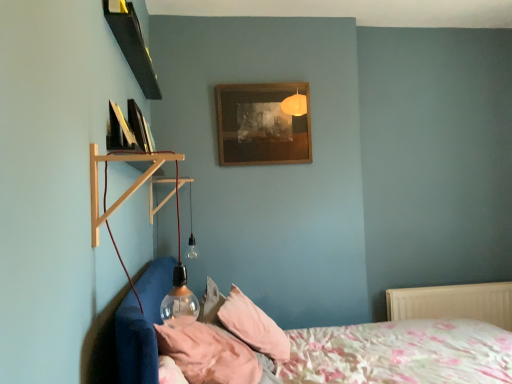
Where is `wooden frame at upper center, marked as the 1th picture frame in a back-to-front arrangement`? The height and width of the screenshot is (384, 512). wooden frame at upper center, marked as the 1th picture frame in a back-to-front arrangement is located at coordinates (261, 125).

What do you see at coordinates (253, 326) in the screenshot? I see `pink fabric pillow at lower center, which is the second pillow in front-to-back order` at bounding box center [253, 326].

Locate an element on the screen. floral cotton bed at lower left is located at coordinates (401, 353).

Where is `wooden frame at upper center, marked as the 1th picture frame in a back-to-front arrangement`? Image resolution: width=512 pixels, height=384 pixels. wooden frame at upper center, marked as the 1th picture frame in a back-to-front arrangement is located at coordinates (261, 125).

Can you tell me how much pink fabric pillow at lower center, which is the second pillow in front-to-back order, and wooden frame at upper center, the second picture frame when ordered from left to right, differ in facing direction?

84.9 degrees separate the facing orientations of pink fabric pillow at lower center, which is the second pillow in front-to-back order, and wooden frame at upper center, the second picture frame when ordered from left to right.

From the picture: From a real-world perspective, which object stands above the other?

wooden frame at upper center, marked as the 1th picture frame in a back-to-front arrangement, from a real-world perspective.

Which is closer to the camera, [228,317] or [253,111]?

Point [228,317].

From a real-world perspective, is pink fabric pillow at lower center, the 1th pillow positioned from the back, below floral cotton bed at lower left?

No, from a real-world perspective, pink fabric pillow at lower center, the 1th pillow positioned from the back, is not under floral cotton bed at lower left.

Which is more to the left, pink fabric pillow at lower center, the 1th pillow positioned from the back, or floral cotton bed at lower left?

Positioned to the left is pink fabric pillow at lower center, the 1th pillow positioned from the back.

Considering the points (278, 341) and (471, 352), which point is behind, point (278, 341) or point (471, 352)?

The point (278, 341) is farther.

Is pink fabric pillow at lower center, which appears as the 1th pillow when viewed from the front, a part of white plastic radiator at lower right?

No, white plastic radiator at lower right does not contain pink fabric pillow at lower center, which appears as the 1th pillow when viewed from the front.

Which is closer, [466,303] or [251,381]?

Clearly, point [466,303] is more distant from the camera than point [251,381].

What's the angular difference between white plastic radiator at lower right and pink fabric pillow at lower center, which appears as the 1th pillow when viewed from the front,'s facing directions?

white plastic radiator at lower right and pink fabric pillow at lower center, which appears as the 1th pillow when viewed from the front, are facing 75 degrees away from each other.

Based on the photo, from the image's perspective, who appears lower, white plastic radiator at lower right or pink fabric pillow at lower center, which appears as the 1th pillow when viewed from the front?

white plastic radiator at lower right is shown below in the image.

Which of these two, black glossy picture frame at upper left, acting as the first picture frame starting from the left, or floral cotton bed at lower left, stands shorter?

With less height is black glossy picture frame at upper left, acting as the first picture frame starting from the left.

From a real-world perspective, who is located lower, black glossy picture frame at upper left, which appears as the first picture frame when viewed from the front, or floral cotton bed at lower left?

floral cotton bed at lower left is physically lower.

Is black glossy picture frame at upper left, positioned as the 2th picture frame in back-to-front order, aimed at floral cotton bed at lower left?

No, black glossy picture frame at upper left, positioned as the 2th picture frame in back-to-front order, is not aimed at floral cotton bed at lower left.

Consider the image. Is black glossy picture frame at upper left, positioned as the 2th picture frame in back-to-front order, spatially inside floral cotton bed at lower left, or outside of it?

black glossy picture frame at upper left, positioned as the 2th picture frame in back-to-front order, lies outside floral cotton bed at lower left.

Looking at their sizes, would you say black glossy picture frame at upper left, positioned as the 2th picture frame in back-to-front order, is wider or thinner than pink fabric pillow at lower center, which is the second pillow in front-to-back order?

Clearly, black glossy picture frame at upper left, positioned as the 2th picture frame in back-to-front order, has less width compared to pink fabric pillow at lower center, which is the second pillow in front-to-back order.

Can you confirm if black glossy picture frame at upper left, which appears as the first picture frame when viewed from the front, is taller than pink fabric pillow at lower center, the 1th pillow positioned from the back?

Incorrect, the height of black glossy picture frame at upper left, which appears as the first picture frame when viewed from the front, is not larger of that of pink fabric pillow at lower center, the 1th pillow positioned from the back.

From the image's perspective, which is below, black glossy picture frame at upper left, positioned as the 2th picture frame in back-to-front order, or pink fabric pillow at lower center, the 1th pillow positioned from the back?

pink fabric pillow at lower center, the 1th pillow positioned from the back, appears lower in the image.

Considering their positions, is black glossy picture frame at upper left, which appears as the first picture frame when viewed from the front, located in front of or behind pink fabric pillow at lower center, which is the second pillow in front-to-back order?

Clearly, black glossy picture frame at upper left, which appears as the first picture frame when viewed from the front, is in front of pink fabric pillow at lower center, which is the second pillow in front-to-back order.

Which is more to the left, wooden frame at upper center, the second picture frame when ordered from left to right, or pink fabric pillow at lower center, which appears as the 1th pillow when viewed from the front?

pink fabric pillow at lower center, which appears as the 1th pillow when viewed from the front.

Starting from the wooden frame at upper center, marked as the 1th picture frame in a back-to-front arrangement, which pillow is the 2nd one to the left? Please provide its 2D coordinates.

[(208, 354)]

From a real-world perspective, is wooden frame at upper center, the second picture frame when ordered from left to right, positioned above or below pink fabric pillow at lower center, which is the second pillow in back-to-front order?

wooden frame at upper center, the second picture frame when ordered from left to right, is situated higher than pink fabric pillow at lower center, which is the second pillow in back-to-front order, in the real world.

Is wooden frame at upper center, marked as the 1th picture frame in a back-to-front arrangement, further to camera compared to pink fabric pillow at lower center, which is the second pillow in front-to-back order?

Yes, wooden frame at upper center, marked as the 1th picture frame in a back-to-front arrangement, is further from the viewer.

From a real-world perspective, relative to pink fabric pillow at lower center, which is the second pillow in front-to-back order, is wooden frame at upper center, the second picture frame when ordered from left to right, vertically above or below?

wooden frame at upper center, the second picture frame when ordered from left to right, is above pink fabric pillow at lower center, which is the second pillow in front-to-back order.

In the scene shown: How distant is wooden frame at upper center, marked as the 1th picture frame in a back-to-front arrangement, from pink fabric pillow at lower center, the 1th pillow positioned from the back?

wooden frame at upper center, marked as the 1th picture frame in a back-to-front arrangement, is 1.11 meters away from pink fabric pillow at lower center, the 1th pillow positioned from the back.

Where is `the 1st pillow in front of the wooden frame at upper center, arranged as the first picture frame when viewed from the right`? The image size is (512, 384). the 1st pillow in front of the wooden frame at upper center, arranged as the first picture frame when viewed from the right is located at coordinates (253, 326).

In order to click on pillow that is the 1st object above the floral cotton bed at lower left (from a real-world perspective) in this screenshot , I will do `click(253, 326)`.

Based on their spatial positions, is wooden frame at upper center, marked as the 1th picture frame in a back-to-front arrangement, or white plastic radiator at lower right further from floral cotton bed at lower left?

Based on the image, wooden frame at upper center, marked as the 1th picture frame in a back-to-front arrangement, appears to be further to floral cotton bed at lower left.

Based on their spatial positions, is wooden frame at upper center, arranged as the first picture frame when viewed from the right, or floral cotton bed at lower left closer to pink fabric pillow at lower center, which is the second pillow in back-to-front order?

floral cotton bed at lower left is positioned closer to the anchor pink fabric pillow at lower center, which is the second pillow in back-to-front order.

Looking at the image, which one is located closer to pink fabric pillow at lower center, which is the second pillow in front-to-back order, wooden shelf at left or white plastic radiator at lower right?

wooden shelf at left lies closer to pink fabric pillow at lower center, which is the second pillow in front-to-back order, than the other object.

Which object lies further to the anchor point wooden shelf at left, black glossy picture frame at upper left, acting as the first picture frame starting from the left, or white plastic radiator at lower right?

white plastic radiator at lower right is positioned further to the anchor wooden shelf at left.

Based on the photo, from the image, which object appears to be nearer to wooden shelf at left, pink fabric pillow at lower center, which is the second pillow in back-to-front order, or floral cotton bed at lower left?

pink fabric pillow at lower center, which is the second pillow in back-to-front order, is positioned closer to the anchor wooden shelf at left.

When comparing their distances from black glossy picture frame at upper left, which appears as the first picture frame when viewed from the front, does pink fabric pillow at lower center, which is the second pillow in front-to-back order, or wooden shelf at left seem closer?

wooden shelf at left lies closer to black glossy picture frame at upper left, which appears as the first picture frame when viewed from the front, than the other object.

When comparing their distances from pink fabric pillow at lower center, which is the second pillow in back-to-front order, does black glossy picture frame at upper left, which appears as the first picture frame when viewed from the front, or white plastic radiator at lower right seem further?

white plastic radiator at lower right lies further to pink fabric pillow at lower center, which is the second pillow in back-to-front order, than the other object.

When comparing their distances from pink fabric pillow at lower center, the 1th pillow positioned from the back, does floral cotton bed at lower left or white plastic radiator at lower right seem further?

white plastic radiator at lower right.

You are a GUI agent. You are given a task and a screenshot of the screen. Output one action in this format:
    pyautogui.click(x=<x>, y=<y>)
    Task: Click on the picture frame between wooden shelf at left and wooden frame at upper center, marked as the 1th picture frame in a back-to-front arrangement, from front to back
    
    Given the screenshot: What is the action you would take?
    pyautogui.click(x=120, y=131)

Locate an element on the screen. The width and height of the screenshot is (512, 384). shelf between floral cotton bed at lower left and white plastic radiator at lower right along the z-axis is located at coordinates (128, 188).

Identify the location of picture frame between black glossy picture frame at upper left, positioned as the 2th picture frame in back-to-front order, and white plastic radiator at lower right, in the horizontal direction. The image size is (512, 384). (261, 125).

You are a GUI agent. You are given a task and a screenshot of the screen. Output one action in this format:
    pyautogui.click(x=<x>, y=<y>)
    Task: Click on the picture frame situated between pink fabric pillow at lower center, which is the second pillow in back-to-front order, and white plastic radiator at lower right from left to right
    
    Given the screenshot: What is the action you would take?
    pyautogui.click(x=261, y=125)